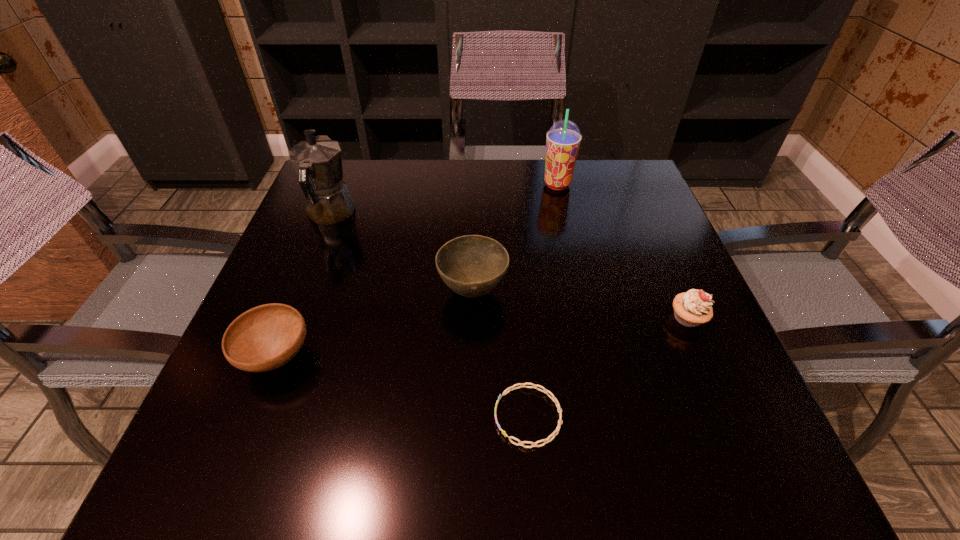
Find the location of `coffeepot present at the left edge`. coffeepot present at the left edge is located at coordinates (317, 161).

Find the location of a particular element. Image resolution: width=960 pixels, height=540 pixels. bowl at the left edge is located at coordinates (266, 337).

The width and height of the screenshot is (960, 540). I want to click on object that is at the right edge, so click(694, 307).

You are a GUI agent. You are given a task and a screenshot of the screen. Output one action in this format:
    pyautogui.click(x=<x>, y=<y>)
    Task: Click on the object positioned at the far left corner
    The height and width of the screenshot is (540, 960).
    Given the screenshot: What is the action you would take?
    pyautogui.click(x=317, y=161)

Find the location of a particular element. The height and width of the screenshot is (540, 960). vacant space at the far edge is located at coordinates (575, 197).

Where is `free region at the near edge of the desktop`? This screenshot has height=540, width=960. free region at the near edge of the desktop is located at coordinates (351, 489).

The height and width of the screenshot is (540, 960). I want to click on free space at the left edge of the desktop, so click(x=324, y=241).

Where is `vacant space at the right edge of the desktop`? vacant space at the right edge of the desktop is located at coordinates (639, 245).

This screenshot has width=960, height=540. In order to click on vacant region at the far left corner of the desktop in this screenshot , I will do `click(354, 184)`.

In the image, there is a desktop. Find the location of `vacant space at the far right corner`. vacant space at the far right corner is located at coordinates (634, 200).